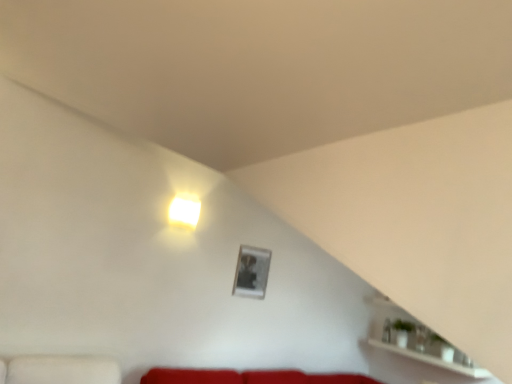
Question: From a real-world perspective, is metallic silver picture frame at upper center positioned above or below white glossy shelf at lower right?

Choices:
 (A) below
 (B) above

Answer: (B)

Question: In the image, is metallic silver picture frame at upper center positioned in front of or behind white glossy shelf at lower right?

Choices:
 (A) behind
 (B) front

Answer: (A)

Question: Which of these objects is positioned farthest from the metallic silver picture frame at upper center?

Choices:
 (A) white glossy cube at upper center
 (B) white glossy shelf at lower right

Answer: (B)

Question: Estimate the real-world distances between objects in this image. Which object is farther from the white glossy cube at upper center?

Choices:
 (A) metallic silver picture frame at upper center
 (B) white glossy shelf at lower right

Answer: (B)